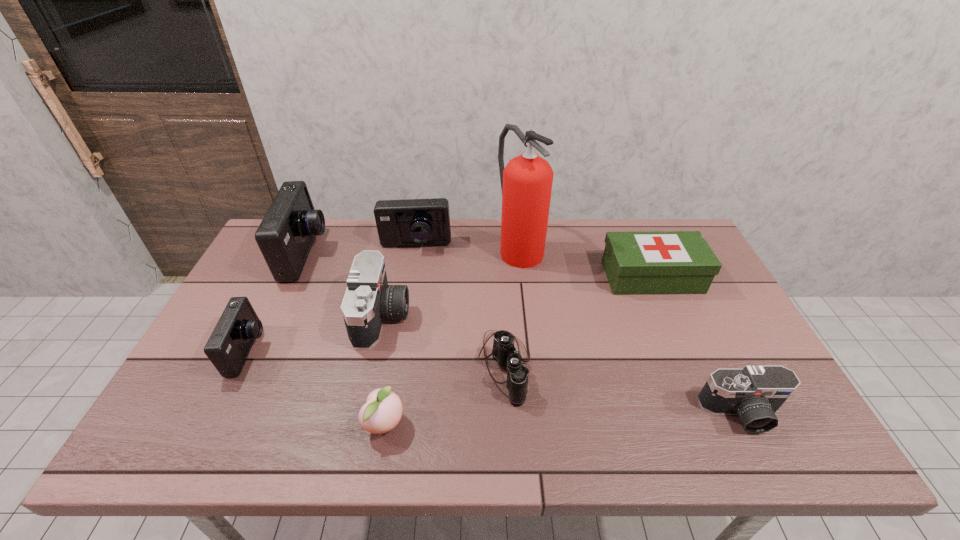
Select which blue camera appears as the second closest to the second tallest object. Please provide its 2D coordinates. Your answer should be formatted as a tuple, i.e. [(x, y)], where the tuple contains the x and y coordinates of a point satisfying the conditions above.

[(412, 222)]

You are a GUI agent. You are given a task and a screenshot of the screen. Output one action in this format:
    pyautogui.click(x=<x>, y=<y>)
    Task: Click on the free space that satisfies the following two spatial constraints: 1. on the front-facing side of the rightmost blue camera; 2. on the front-facing side of the smallest blue camera
    The width and height of the screenshot is (960, 540).
    Given the screenshot: What is the action you would take?
    click(x=396, y=351)

I want to click on vacant space that satisfies the following two spatial constraints: 1. on the front-facing side of the peach; 2. on the right side of the smallest blue camera, so click(x=213, y=423).

I want to click on blank area in the image that satisfies the following two spatial constraints: 1. on the front-facing side of the smallest blue camera; 2. on the back side of the peach, so click(213, 423).

I want to click on vacant area that satisfies the following two spatial constraints: 1. on the front-facing side of the first-aid kit; 2. on the left side of the biggest blue camera, so click(296, 277).

Find the location of a particular element. Image resolution: width=960 pixels, height=540 pixels. free space that satisfies the following two spatial constraints: 1. on the back side of the binoculars; 2. on the front-facing side of the smallest blue camera is located at coordinates (504, 351).

Locate an element on the screen. The width and height of the screenshot is (960, 540). free point that satisfies the following two spatial constraints: 1. on the front-facing side of the farther black camera; 2. on the right side of the binoculars is located at coordinates (372, 367).

This screenshot has width=960, height=540. I want to click on vacant space that satisfies the following two spatial constraints: 1. on the front-facing side of the second tallest object; 2. on the left side of the pink peach, so point(228,423).

Where is `free space in the image that satisfies the following two spatial constraints: 1. on the front-facing side of the tallest camera; 2. on the right side of the first-aid kit`? The width and height of the screenshot is (960, 540). free space in the image that satisfies the following two spatial constraints: 1. on the front-facing side of the tallest camera; 2. on the right side of the first-aid kit is located at coordinates click(x=296, y=277).